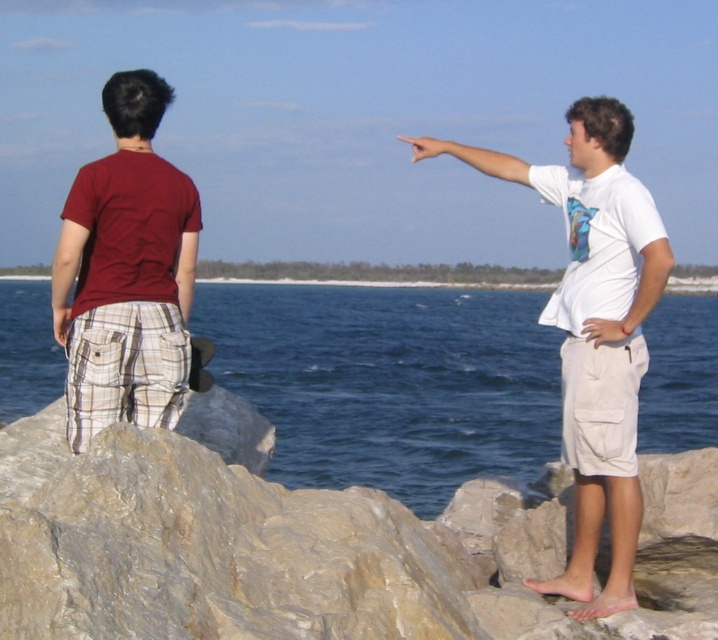
Question: Observing the image, what is the correct spatial positioning of white cotton shirt at right in reference to blue shiny tie at right?

Choices:
 (A) below
 (B) above

Answer: (B)

Question: In this image, where is matte red t-shirt at left located relative to blue shiny tie at right?

Choices:
 (A) left
 (B) right

Answer: (A)

Question: Which point is closer to the camera?

Choices:
 (A) (157, 552)
 (B) (74, 397)
 (C) (624, 476)

Answer: (A)

Question: Which of these objects is positioned closest to the smooth gray rock at center?

Choices:
 (A) white cotton shirt at right
 (B) blue water at center

Answer: (A)

Question: Is smooth gray rock at center further to camera compared to blue shiny tie at right?

Choices:
 (A) yes
 (B) no

Answer: (B)

Question: Among these points, which one is farthest from the camera?

Choices:
 (A) (707, 493)
 (B) (572, 211)
 (C) (454, 291)

Answer: (C)